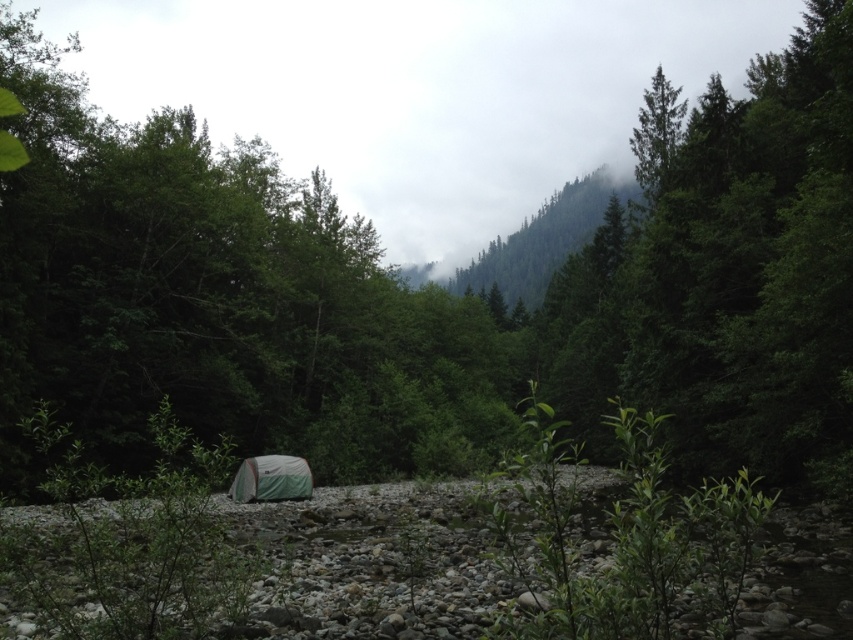
Question: Is green needle-like tree at upper right bigger than white fabric tent at center?

Choices:
 (A) yes
 (B) no

Answer: (A)

Question: Observing the image, what is the correct spatial positioning of green needle-like tree at upper right in reference to white fabric tent at center?

Choices:
 (A) right
 (B) left

Answer: (A)

Question: In this image, where is green needle-like tree at upper right located relative to white fabric tent at center?

Choices:
 (A) left
 (B) right

Answer: (B)